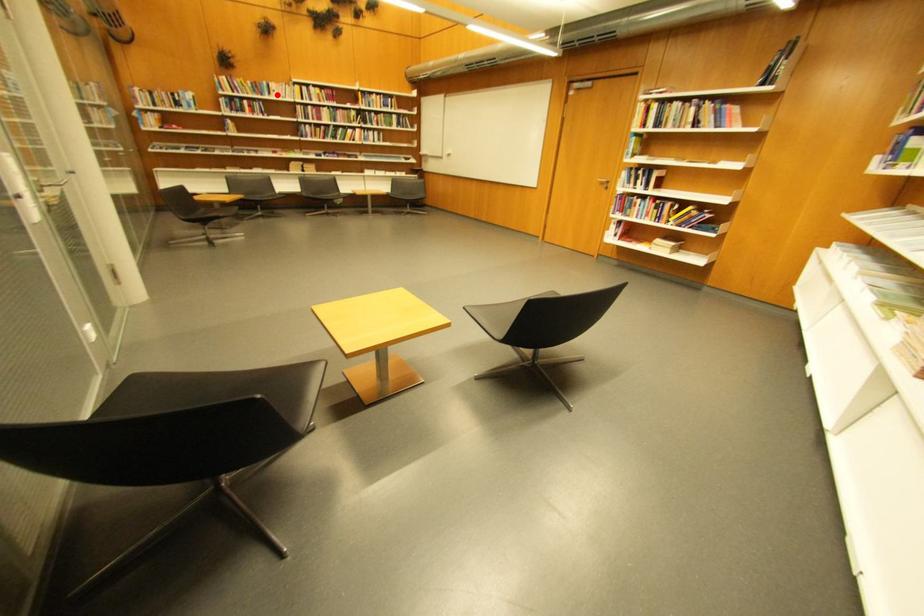
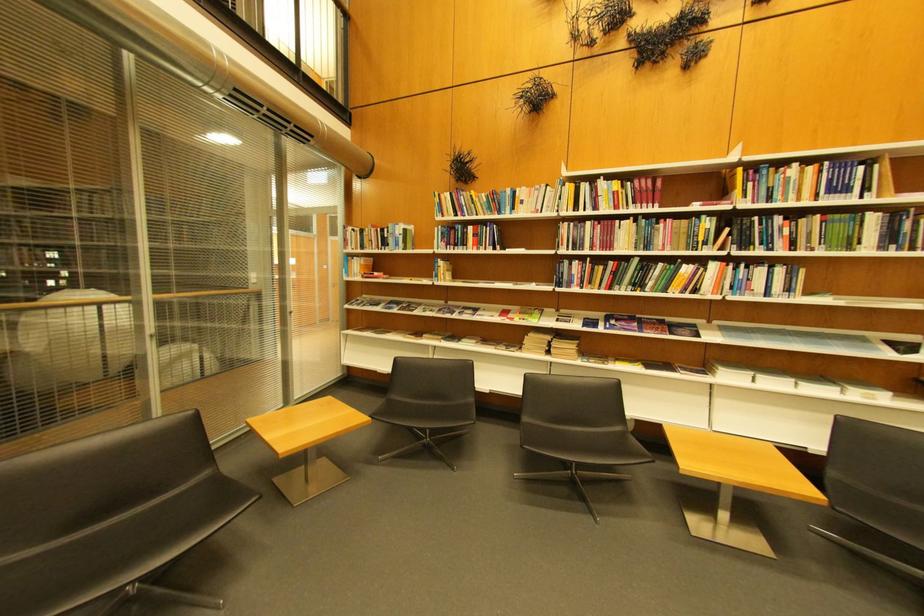
Find the pixel in the second image that matches the highlighted location in the first image.

(518, 209)